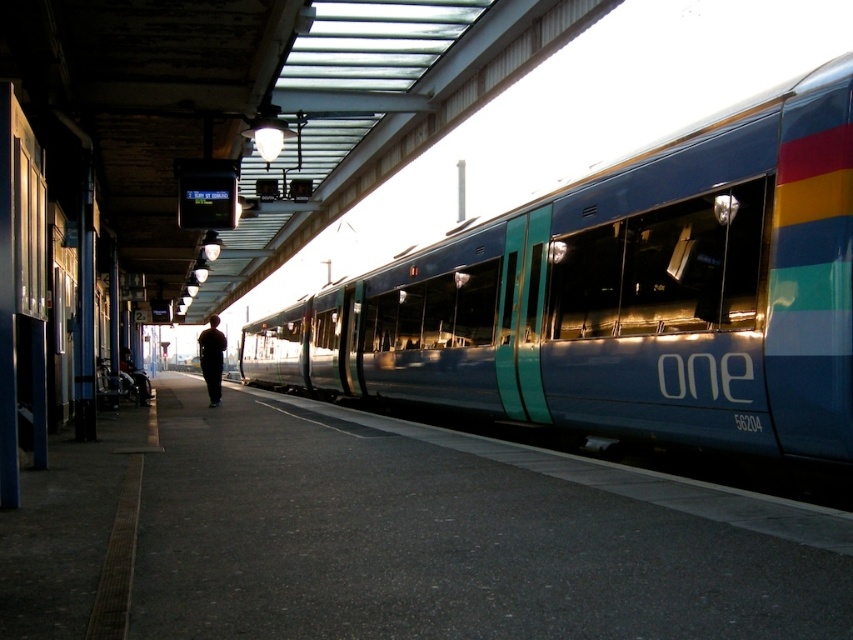
Question: Which object is closer to the camera taking this photo?

Choices:
 (A) dark blue wheelchair at lower left
 (B) dark fabric shirt at center

Answer: (B)

Question: Which point is closer to the camera?

Choices:
 (A) (703, 166)
 (B) (144, 380)
 (C) (207, 390)

Answer: (A)

Question: Does metallic blue train at center have a greater width compared to dark blue wheelchair at lower left?

Choices:
 (A) no
 (B) yes

Answer: (B)

Question: Does metallic blue train at center have a larger size compared to dark fabric shirt at center?

Choices:
 (A) yes
 (B) no

Answer: (B)

Question: Among these objects, which one is nearest to the camera?

Choices:
 (A) dark blue wheelchair at lower left
 (B) metallic blue train at center

Answer: (B)

Question: Does dark fabric shirt at center appear over dark blue wheelchair at lower left?

Choices:
 (A) no
 (B) yes

Answer: (B)